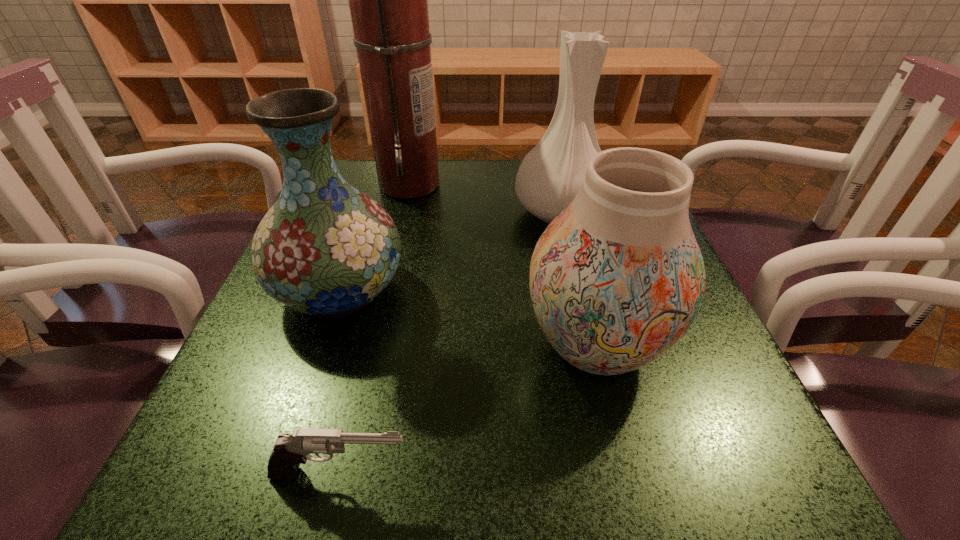
This screenshot has width=960, height=540. Find the location of `fire extinguisher`. fire extinguisher is located at coordinates (388, 2).

The image size is (960, 540). Find the location of `the farthest vase`. the farthest vase is located at coordinates (550, 176).

This screenshot has width=960, height=540. What are the coordinates of `the leftmost vase` in the screenshot? It's located at (326, 249).

At what (x,y) coordinates should I click in order to perform the action: click on gun. Please return your answer as a coordinate pair (x, y). The image size is (960, 540). Looking at the image, I should click on click(289, 451).

You are a GUI agent. You are given a task and a screenshot of the screen. Output one action in this format:
    pyautogui.click(x=<x>, y=<y>)
    Task: Click on the shortest object
    
    Given the screenshot: What is the action you would take?
    pyautogui.click(x=289, y=451)

Image resolution: width=960 pixels, height=540 pixels. Identify the location of free space located on the front-facing side of the tallest object. (558, 184).

Locate an element on the screen. This screenshot has width=960, height=540. free space located 0.090m on the back of the farthest vase is located at coordinates tap(550, 171).

You are a GUI agent. You are given a task and a screenshot of the screen. Output one action in this format:
    pyautogui.click(x=<x>, y=<y>)
    Task: Click on the blank space located on the right of the leftmost vase
    The height and width of the screenshot is (540, 960).
    Given the screenshot: What is the action you would take?
    (x=463, y=289)

Image resolution: width=960 pixels, height=540 pixels. I want to click on vacant region located at the muzzle of the gun, so click(x=610, y=474).

Find the location of `fire extinguisher present at the far edge`. fire extinguisher present at the far edge is located at coordinates (388, 2).